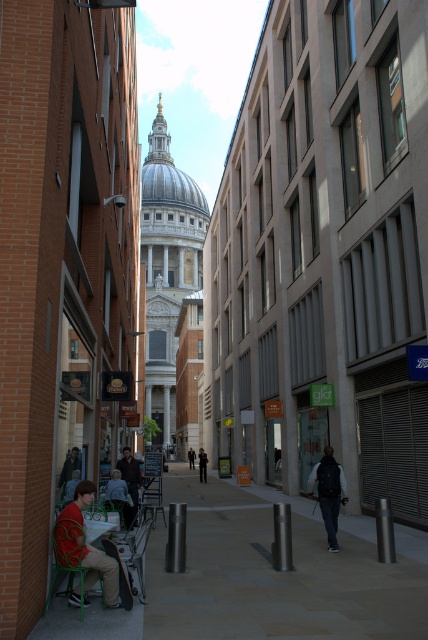
Which is in front, point (152, 604) or point (189, 456)?

Point (152, 604) is in front.

I want to click on smooth concrete pavement at center, so click(x=279, y=573).

Does red fabric shirt at lower left appear on the left side of dark blue backpack at center?

Correct, you'll find red fabric shirt at lower left to the left of dark blue backpack at center.

Who is more distant from viewer, (59, 547) or (329, 500)?

The point (329, 500) is behind.

Does point (89, 586) come in front of point (335, 481)?

Yes, point (89, 586) is closer to viewer.

At what (x,y) coordinates should I click in order to perform the action: click on red fabric shirt at lower left. Please return your answer as a coordinate pair (x, y). Looking at the image, I should click on (92, 564).

Can you confirm if dark blue backpack at center is thinner than dark brown leather jacket at lower left?

Indeed, dark blue backpack at center has a lesser width compared to dark brown leather jacket at lower left.

What are the coordinates of `dark blue backpack at center` in the screenshot? It's located at (329, 492).

Find the location of a particular element. This screenshot has width=428, height=640. dark blue backpack at center is located at coordinates (329, 492).